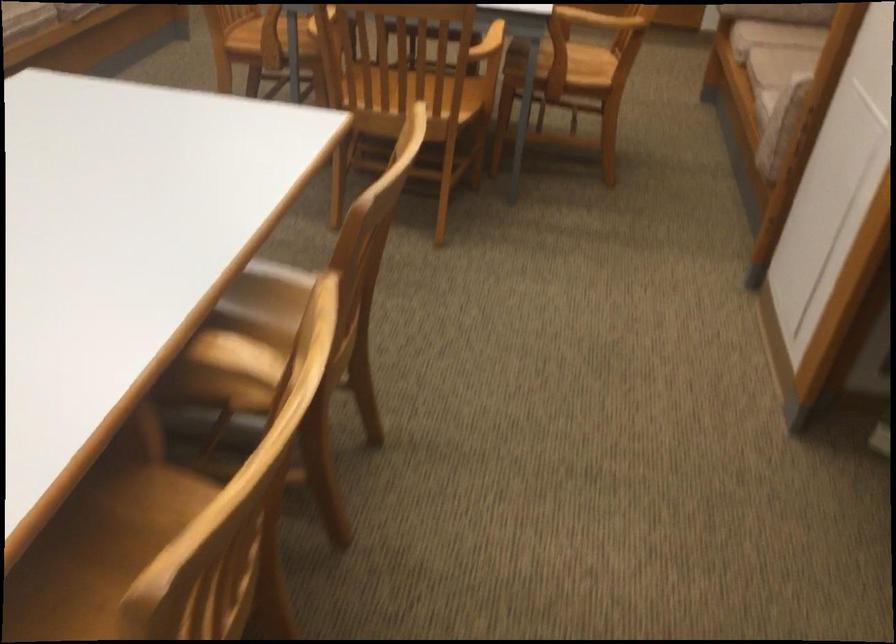
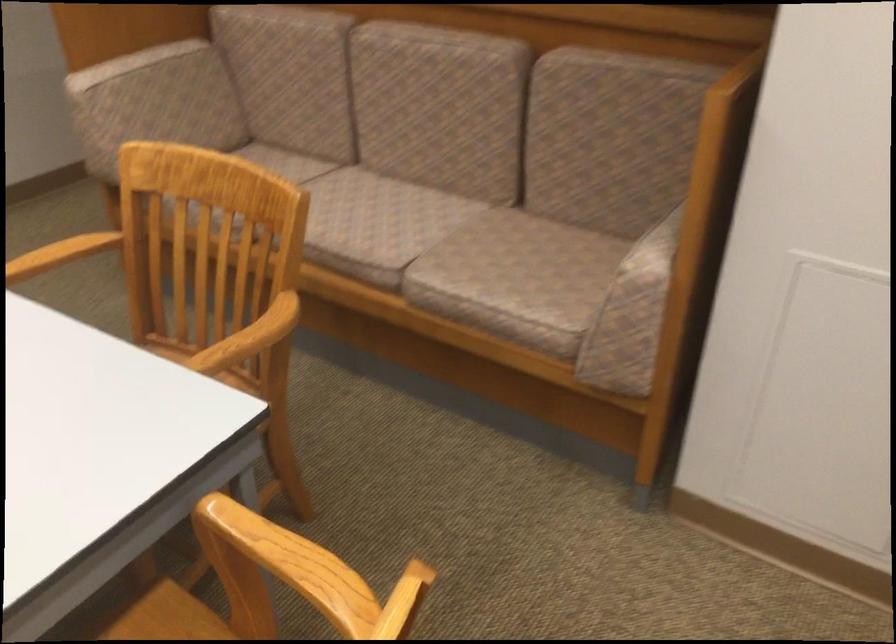
Question: I am providing you with two images of the same scene from different viewpoints. Please identify which objects are invisible in image2.

Choices:
 (A) upholstered sofa sitting surface
 (B) wooden chair sitting surface
 (C) upholstered sofa armrest
 (D) small blue globe

Answer: (B)